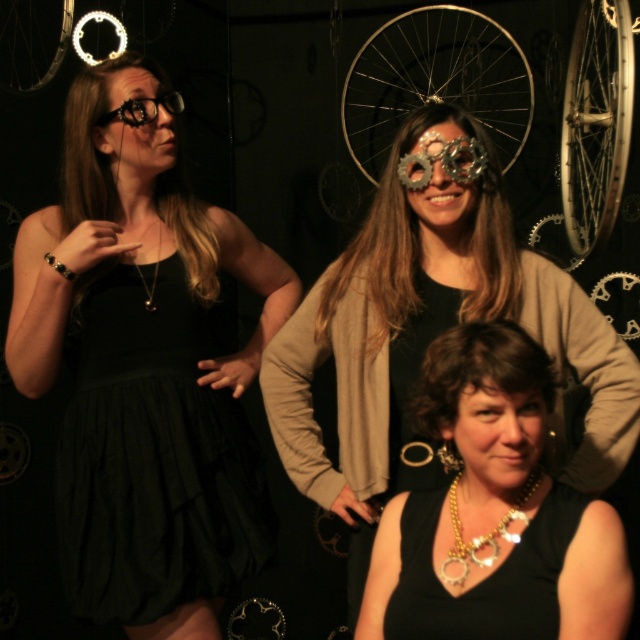
Question: Is metallic silver necklace at center positioned at the back of gold metallic bicycle wheel at upper right?

Choices:
 (A) no
 (B) yes

Answer: (A)

Question: Can you confirm if matte black necklace at center is positioned to the left of gold metallic necklace at lower center?

Choices:
 (A) yes
 (B) no

Answer: (B)

Question: Which object appears farthest from the camera in this image?

Choices:
 (A) matte black necklace at center
 (B) matte black dress at left
 (C) matte gold necklace at lower center
 (D) shiny metallic goggles at upper left

Answer: (D)

Question: Estimate the real-world distances between objects in this image. Which object is closer to the gold metallic necklace at lower center?

Choices:
 (A) black matte dress at lower center
 (B) metallic silver necklace at center
 (C) gold metallic bicycle wheel at upper right

Answer: (A)

Question: Does gold metallic bicycle wheel at upper right appear on the left side of metallic gear at center?

Choices:
 (A) yes
 (B) no

Answer: (B)

Question: Which object is farther from the camera taking this photo?

Choices:
 (A) shiny metallic goggles at upper left
 (B) matte black dress at left
 (C) silver metallic bicycle wheel at center
 (D) matte black necklace at center

Answer: (C)